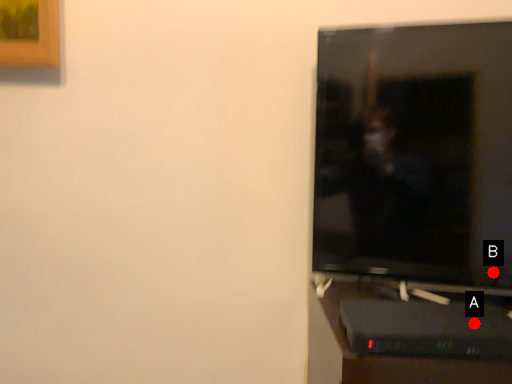
Question: Two points are circled on the image, labeled by A and B beside each circle. Which point is closer to the camera?

Choices:
 (A) A is closer
 (B) B is closer

Answer: (A)